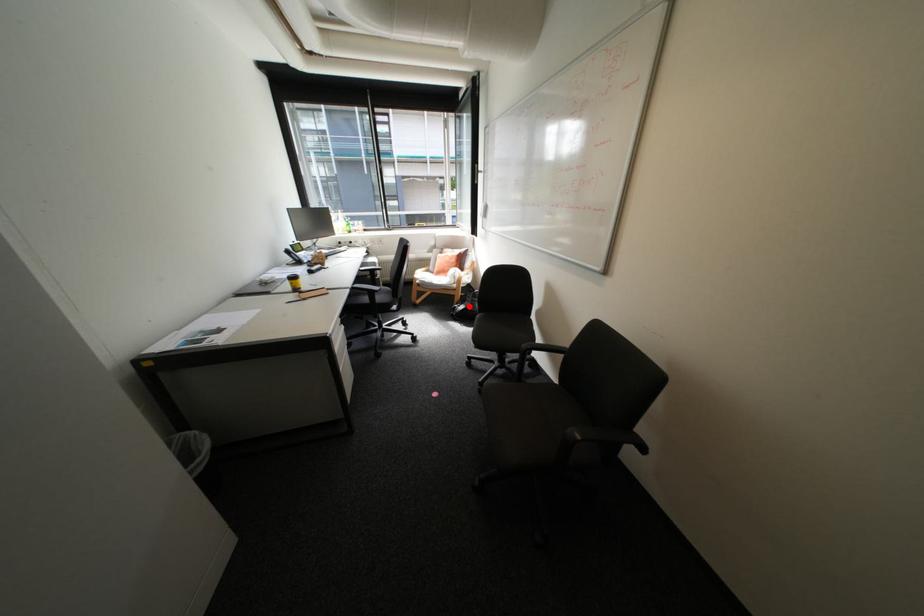
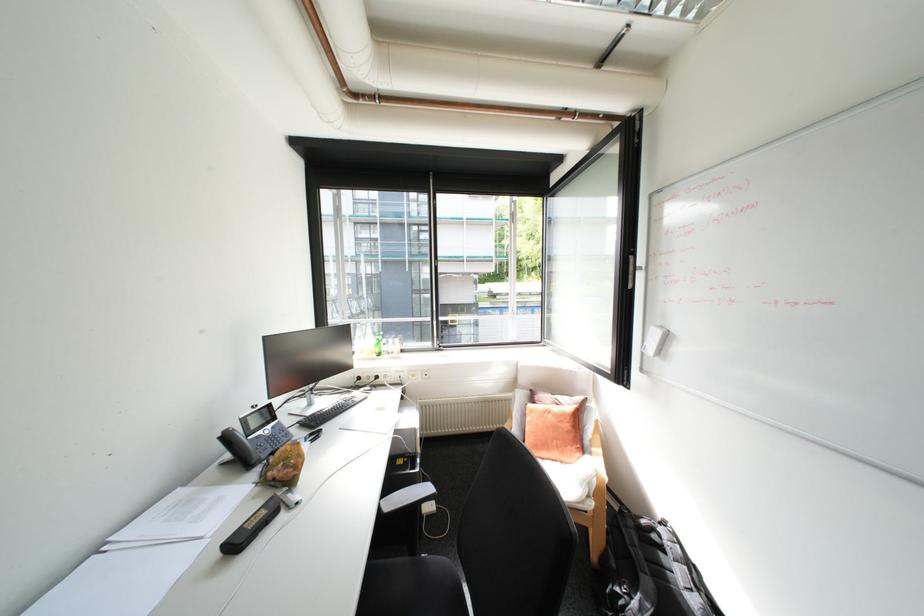
Locate, in the second image, the point that corresponds to the highlighted location in the first image.

(640, 598)